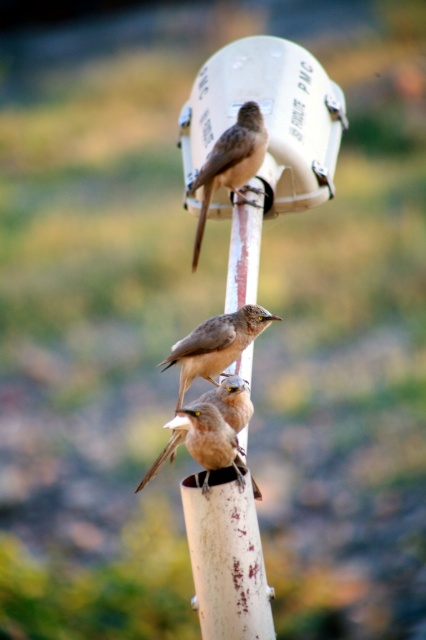
Question: Can you confirm if white matte bird feeder at upper center is positioned to the left of brown feathered bird at center?

Choices:
 (A) yes
 (B) no

Answer: (B)

Question: Among these objects, which one is nearest to the camera?

Choices:
 (A) brown matte bird at upper center
 (B) brown feathered bird at center
 (C) white matte bird feeder at upper center

Answer: (B)

Question: Which object is farther from the camera taking this photo?

Choices:
 (A) brown matte bird at lower center
 (B) brown feathered bird at center
 (C) white matte bird feeder at upper center
 (D) brown matte bird at upper center

Answer: (C)

Question: Which point is closer to the camera taking this photo?

Choices:
 (A) (218, 170)
 (B) (213, 468)
 (C) (322, 138)

Answer: (B)

Question: Is white matte bird feeder at upper center bigger than brown matte bird at upper center?

Choices:
 (A) yes
 (B) no

Answer: (A)

Question: Is white matte bird feeder at upper center to the right of brown feathered bird at center from the viewer's perspective?

Choices:
 (A) no
 (B) yes

Answer: (B)